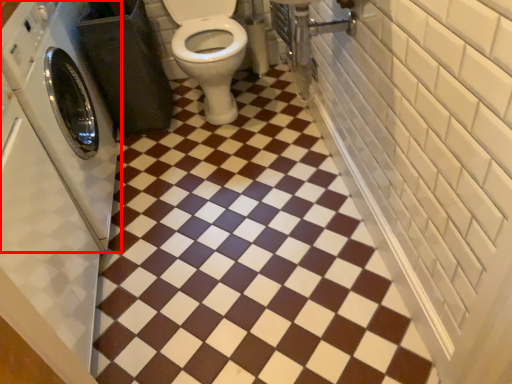
Question: Considering the relative positions of washing machine (annotated by the red box) and ceramic tile in the image provided, where is washing machine (annotated by the red box) located with respect to the staircase?

Choices:
 (A) right
 (B) left

Answer: (B)